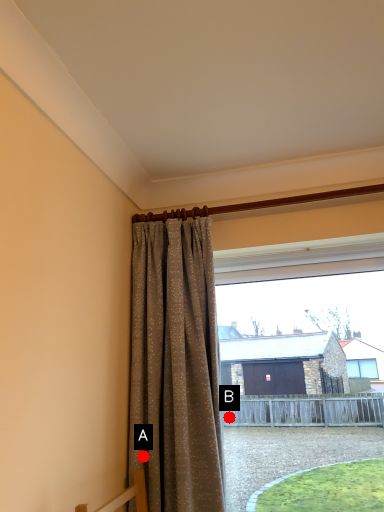
Question: Two points are circled on the image, labeled by A and B beside each circle. Which point is closer to the camera?

Choices:
 (A) A is closer
 (B) B is closer

Answer: (A)